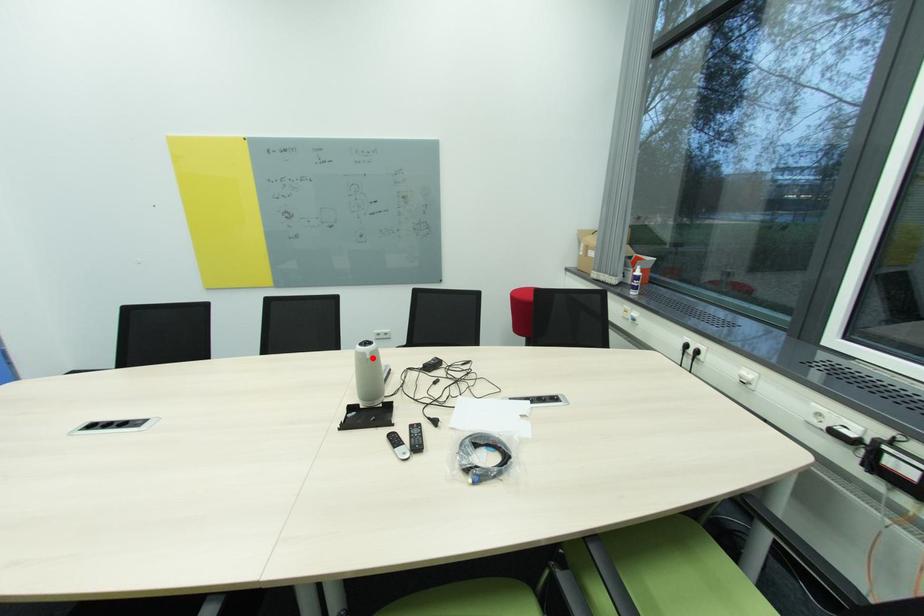
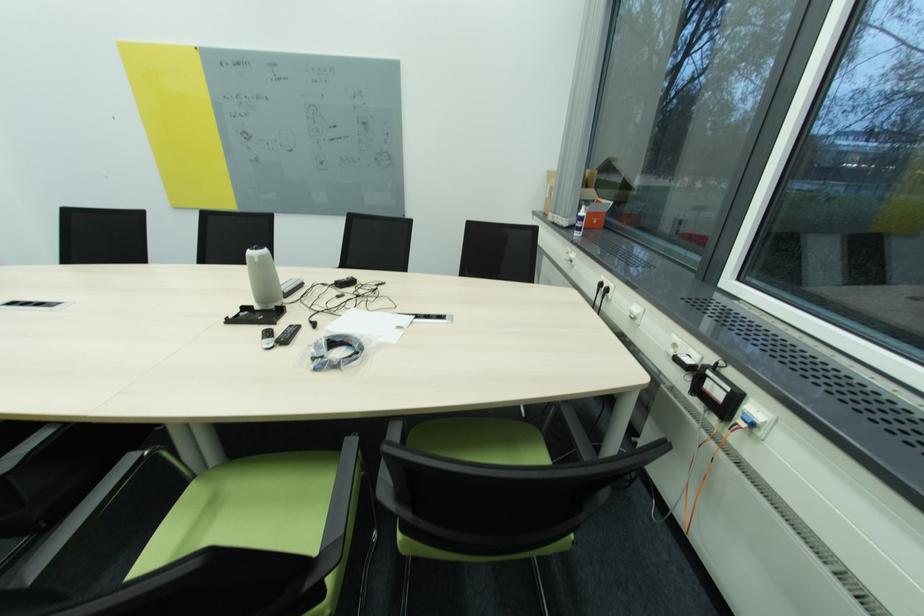
Question: I am providing you with two images of the same scene from different viewpoints. A red point is shown in image1. For the corresponding object point in image2, is it positioned nearer or farther from the camera?

Choices:
 (A) Nearer
 (B) Farther

Answer: (B)